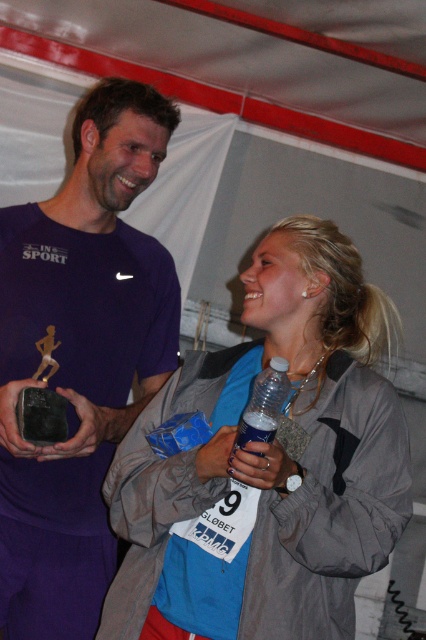
Question: Which point appears closest to the camera in this image?

Choices:
 (A) (282, 467)
 (B) (8, 426)
 (C) (267, 401)

Answer: (A)

Question: Is matte purple shirt at center thinner than matte plastic water bottle at lower center?

Choices:
 (A) no
 (B) yes

Answer: (A)

Question: Considering the relative positions of blue matte water bottle at center and matte plastic water bottle at lower center in the image provided, where is blue matte water bottle at center located with respect to matte plastic water bottle at lower center?

Choices:
 (A) right
 (B) left

Answer: (A)

Question: Which is farther from the gray fabric jacket at center?

Choices:
 (A) shiny dark stone trophy at center
 (B) matte purple shirt at center
 (C) blue matte water bottle at center

Answer: (A)

Question: Considering the real-world distances, which object is closest to the blue matte water bottle at center?

Choices:
 (A) clear plastic bottle at center
 (B) matte purple shirt at center

Answer: (A)

Question: Is matte purple shirt at center positioned at the back of clear plastic bottle at center?

Choices:
 (A) yes
 (B) no

Answer: (A)